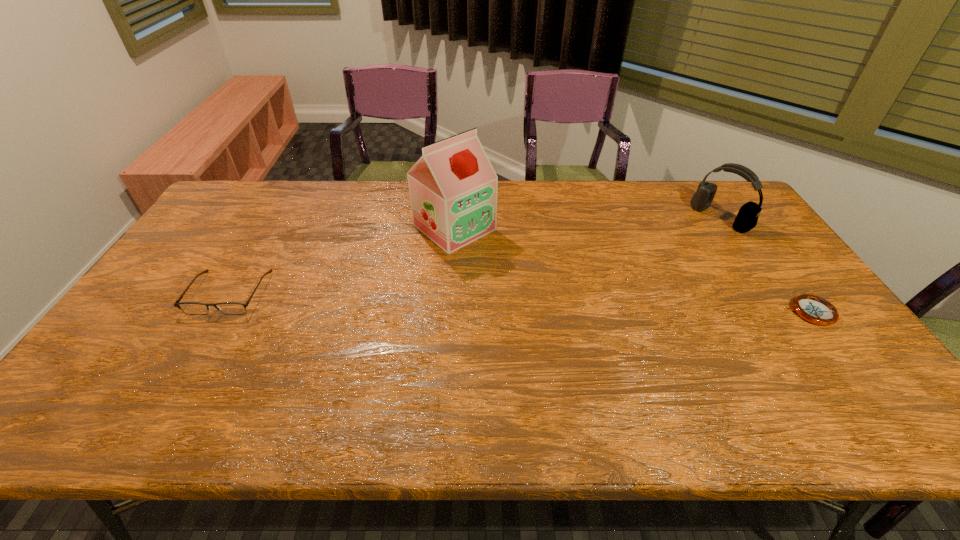
The height and width of the screenshot is (540, 960). I want to click on the leftmost object, so click(x=231, y=308).

Locate an element on the screen. The height and width of the screenshot is (540, 960). the second shortest object is located at coordinates 231,308.

Find the location of a particular element. This screenshot has width=960, height=540. the shortest object is located at coordinates (814, 309).

Identify the location of the tallest object. (453, 187).

Locate an element on the screen. the second object from left to right is located at coordinates (453, 187).

At what (x,y) coordinates should I click in order to perform the action: click on the second tallest object. Please return your answer as a coordinate pair (x, y). Looking at the image, I should click on (747, 217).

You are a GUI agent. You are given a task and a screenshot of the screen. Output one action in this format:
    pyautogui.click(x=<x>, y=<y>)
    Task: Click on the free spot located on the front-facing side of the second shortest object
    
    Given the screenshot: What is the action you would take?
    pyautogui.click(x=186, y=365)

Identify the location of vacant space located 0.280m on the left of the shortest object. (682, 312).

Find the location of a particular element. The width and height of the screenshot is (960, 540). vacant space situated 0.190m with the cap open on the soya milk is located at coordinates (524, 280).

Where is `free space located 0.150m with the cap open on the soya milk`? free space located 0.150m with the cap open on the soya milk is located at coordinates click(x=515, y=272).